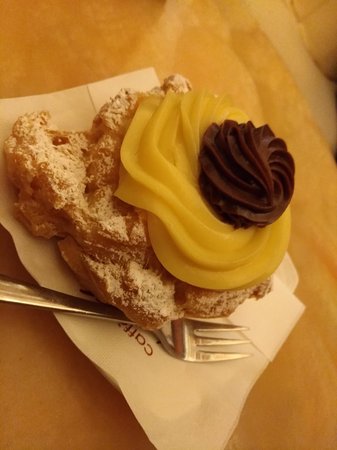
In order to click on glare from light in this screenshot , I will do 186,341, 47,303.